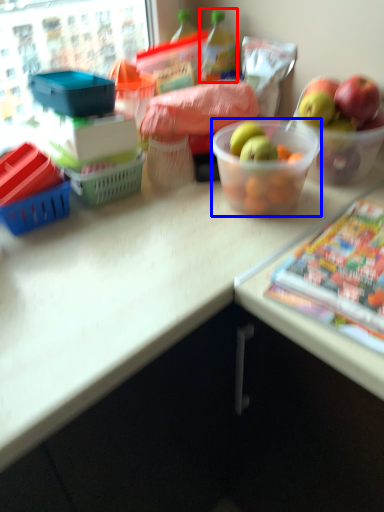
Question: Which object is further to the camera taking this photo, bottle (highlighted by a red box) or bowl (highlighted by a blue box)?

Choices:
 (A) bottle
 (B) bowl

Answer: (A)